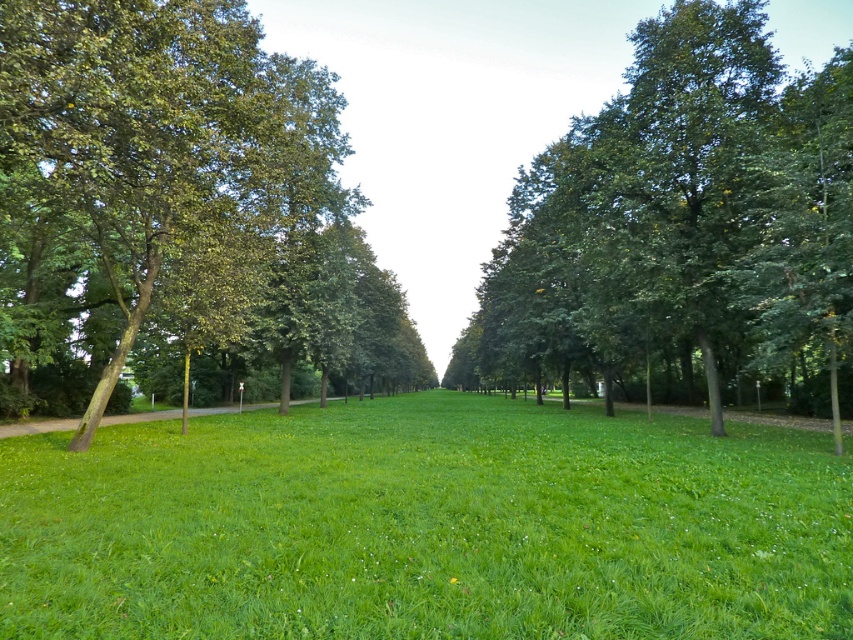
Between green leafy tree at left and green leafy tree at center, which one appears on the right side from the viewer's perspective?

From the viewer's perspective, green leafy tree at center appears more on the right side.

Can you confirm if green leafy tree at left is smaller than green leafy tree at center?

Indeed, green leafy tree at left has a smaller size compared to green leafy tree at center.

The image size is (853, 640). In order to click on green leafy tree at left in this screenshot , I will do `click(177, 211)`.

Does green leafy tree at center have a greater height compared to green grass at center?

Yes, green leafy tree at center is taller than green grass at center.

Who is more forward, (538, 300) or (15, 428)?

Point (15, 428) is more forward.

Is point (583, 268) positioned after point (297, 401)?

No.

Where is `green leafy tree at center`? This screenshot has height=640, width=853. green leafy tree at center is located at coordinates (682, 220).

Is point (708, 529) closer to camera compared to point (102, 420)?

Yes, it is in front of point (102, 420).

Measure the distance between green grassy field at center and camera.

green grassy field at center is 15.02 feet away from camera.

Which is behind, point (38, 506) or point (216, 412)?

The point (216, 412) is more distant.

The image size is (853, 640). What are the coordinates of `green grassy field at center` in the screenshot? It's located at (427, 525).